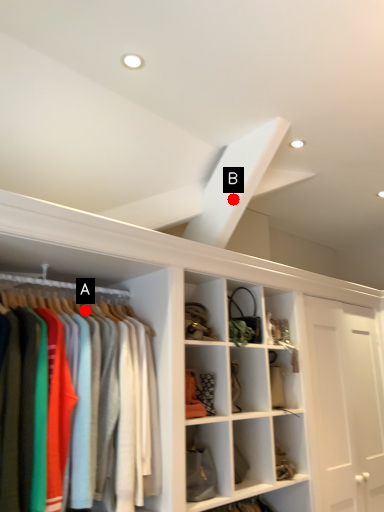
Question: Two points are circled on the image, labeled by A and B beside each circle. Which point appears farthest from the camera in this image?

Choices:
 (A) A is further
 (B) B is further

Answer: (B)